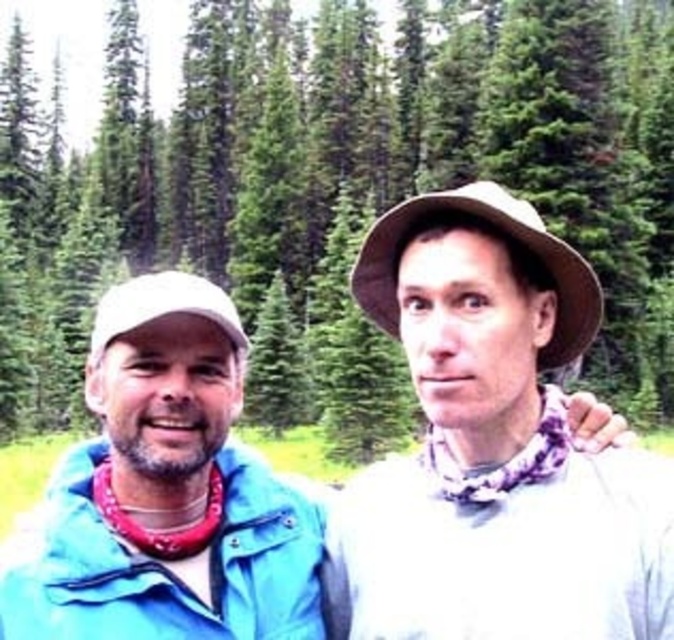
Is green textured pine trees at upper center shorter than blue fabric jacket at left?

No.

What do you see at coordinates (340, 163) in the screenshot? This screenshot has width=674, height=640. I see `green textured pine trees at upper center` at bounding box center [340, 163].

Where is `green textured pine trees at upper center`? This screenshot has height=640, width=674. green textured pine trees at upper center is located at coordinates (340, 163).

Does blue fabric jacket at center have a lesser height compared to green textured pine trees at upper center?

Indeed, blue fabric jacket at center has a lesser height compared to green textured pine trees at upper center.

Who is taller, blue fabric jacket at center or green textured pine trees at upper center?

green textured pine trees at upper center is taller.

Between point (439, 208) and point (111, 60), which one is positioned in front?

Point (439, 208) is in front.

This screenshot has height=640, width=674. I want to click on blue fabric jacket at center, so click(363, 474).

Is blue fabric jacket at center to the left of blue fabric jacket at left from the viewer's perspective?

No, blue fabric jacket at center is not to the left of blue fabric jacket at left.

Between blue fabric jacket at center and blue fabric jacket at left, which one is positioned lower?

Positioned lower is blue fabric jacket at center.

Between point (537, 577) and point (295, 557), which one is positioned behind?

Point (295, 557)

Identify the location of blue fabric jacket at center. (363, 474).